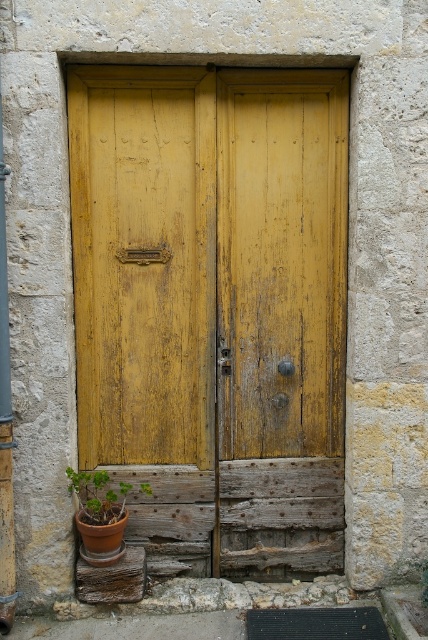
You are a painter standing in front of the yellow wood door at center and the green matte pot at lower left. You want to paint both objects but only have a 1.2 meter wide canvas. Can you fit both objects side by side on the canvas?

The yellow wood door at center is wider than the green matte pot at lower left. Since the canvas is 1.2 meters wide, you need to know their combined width to determine if they can fit. However, the exact widths are not provided, only the comparison. Therefore, it is impossible to confirm if both can fit without knowing their actual dimensions.

You are standing in front of a rustic wooden door set within a weathered stone wall. The door has a yellowish hue with visible cracks and peeling paint. You notice a dark metal handle on the right side and a small rectangular mail slot near the top left corner. The lower part of the door is a darker wood contrasting with the upper section. Based on the coordinates provided, is the yellow wood door at center positioned closer to the top or bottom of the image?

The yellow wood door at center is located at point (x=214, y=305). Since the y coordinate 0.502 is slightly above the center point of the image, the door is positioned closer to the bottom of the image.

You are standing in front of the rustic wooden door and need to place a new plant in a green matte pot. Given the scene, where should you place the green matte pot at lower left relative to the yellow wood door at center to avoid blocking the door?

The green matte pot at lower left should be placed below the yellow wood door at center since the door is above the pot, ensuring the pot does not block the door.